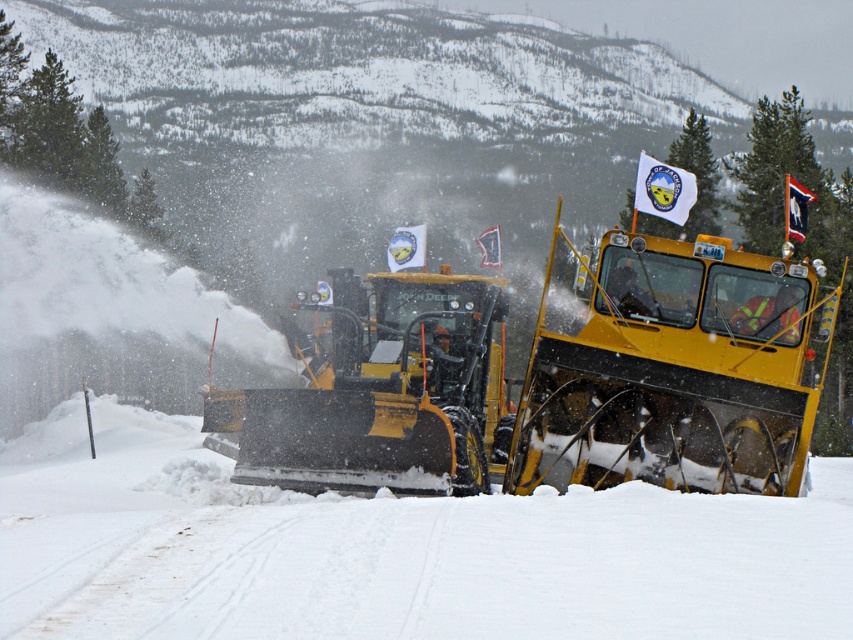
Is yellow matte snowplow at center shorter than yellow metal snowplow at center?

No.

Who is higher up, yellow matte snowplow at center or yellow metal snowplow at center?

yellow matte snowplow at center is higher up.

Identify the location of yellow matte snowplow at center. This screenshot has width=853, height=640. (553, 384).